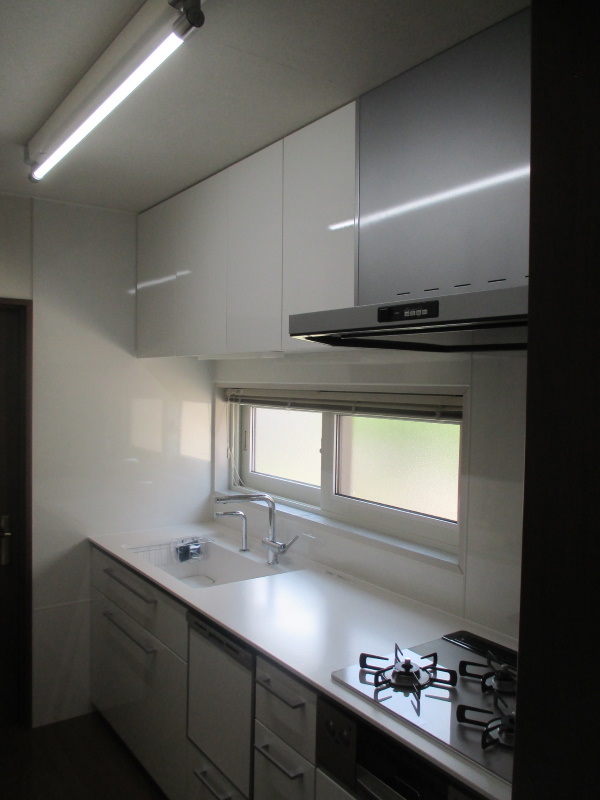
The width and height of the screenshot is (600, 800). Identify the location of kitchen bench. (293, 614).